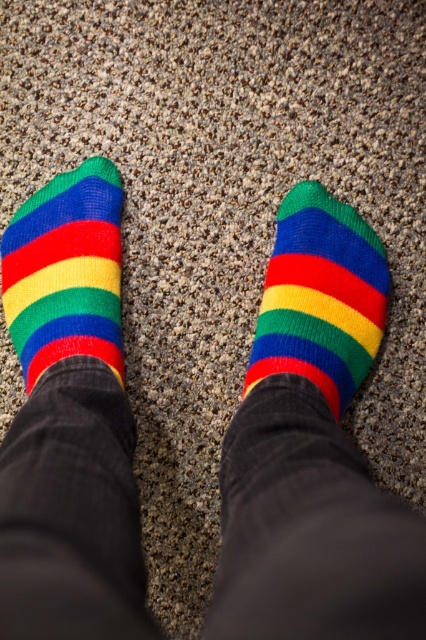
You are a photographer setting up a shoot and need to position two pairs of socks for a product photo. The scene requires that the socks be arranged so that the knitted woolen sock at center is to the right of the knitted wool socks at left. Given the current setup described in the scene, is the arrangement already correct?

Yes, the arrangement is correct because the knitted woolen sock at center is already positioned to the right of the knitted wool socks at left as described in the Objects Description.

You are a fashion designer observing the image of feet with colorful striped socks. You need to determine which sock is longer between the knitted woolen sock at center and the knitted wool socks at left. Which one is taller?

The knitted woolen sock at center is taller than the knitted wool socks at left.

You are a photographer setting up a shoot in a room with the described scene. You need to place a small prop exactly at the point marked by the coordinates point (321, 296). What object will the prop be placed on top of?

The prop will be placed on top of the knitted woolen sock at center, as the coordinates point (321, 296) indicates that location.